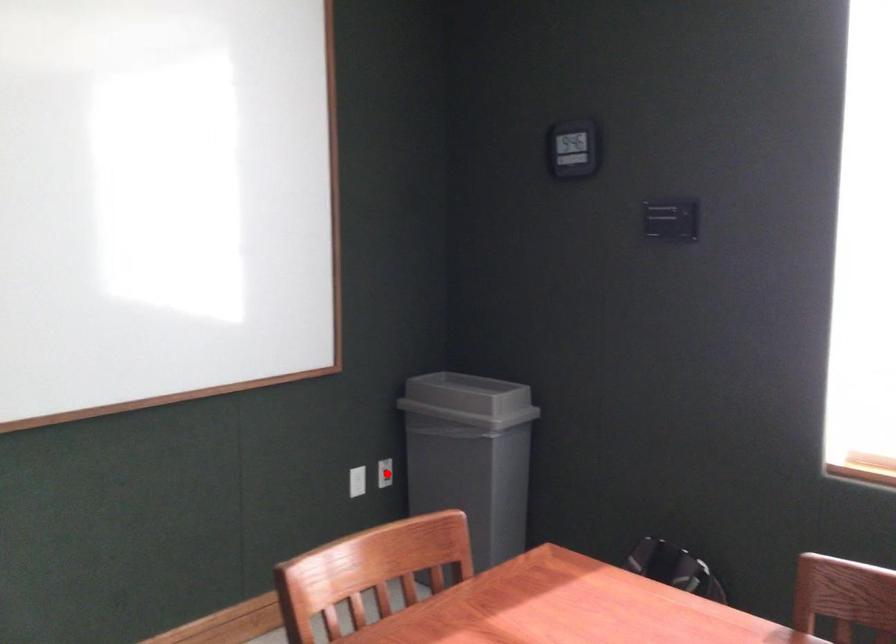
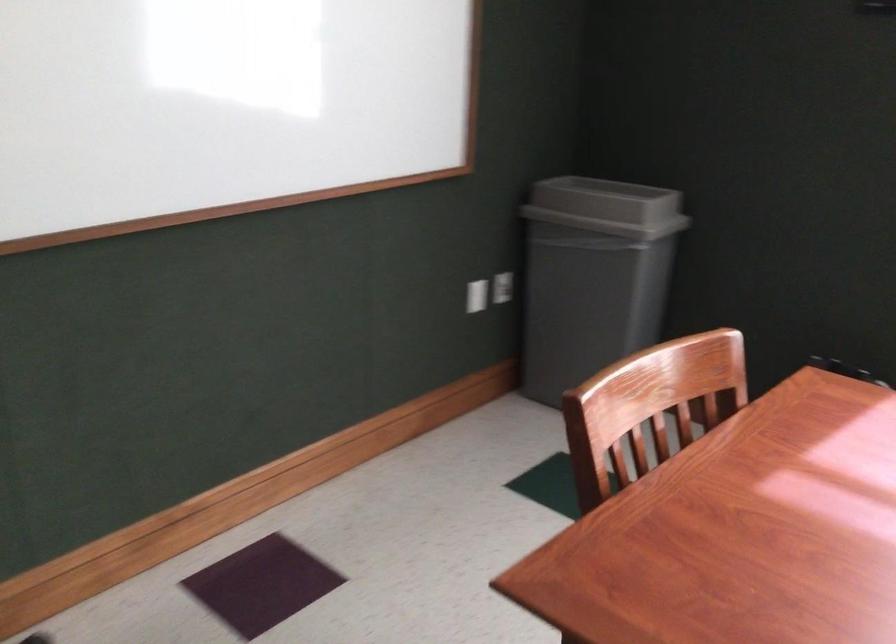
Where in the second image is the point corresponding to the highlighted location from the first image?

(503, 287)